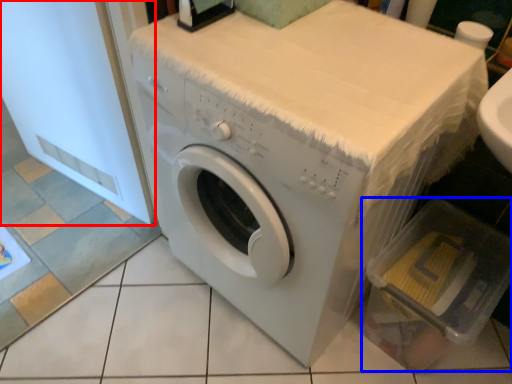
Question: Among these objects, which one is farthest to the camera, screen door (highlighted by a red box) or dish washer (highlighted by a blue box)?

Choices:
 (A) screen door
 (B) dish washer

Answer: (B)